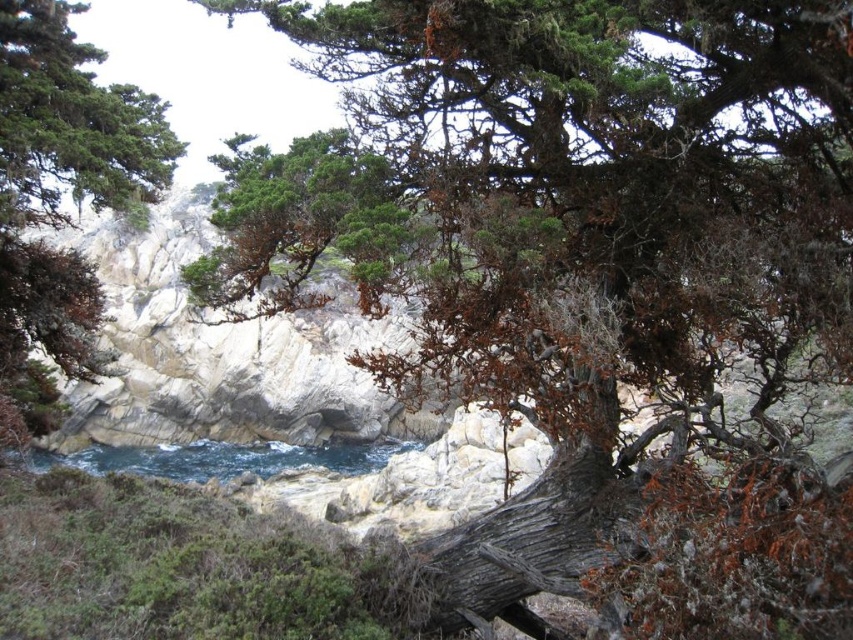
Question: Which point is farther from the camera taking this photo?

Choices:
 (A) [x=160, y=468]
 (B) [x=16, y=74]

Answer: (A)

Question: Can you confirm if green matte tree at upper left is wider than blue water at center?

Choices:
 (A) no
 (B) yes

Answer: (A)

Question: Can you confirm if green matte tree at upper left is thinner than blue water at center?

Choices:
 (A) yes
 (B) no

Answer: (A)

Question: Is green matte tree at upper left above blue water at center?

Choices:
 (A) no
 (B) yes

Answer: (B)